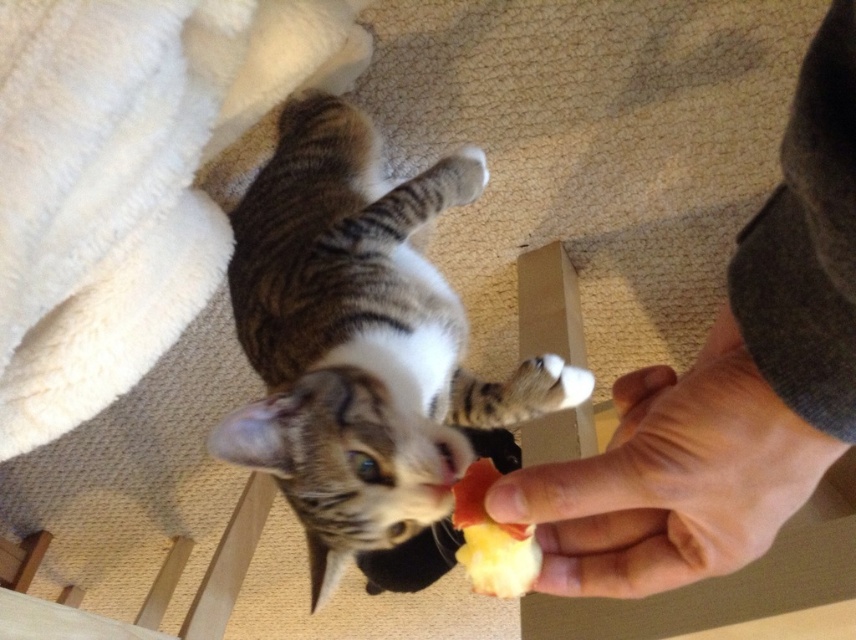
You are a cat owner who wants to feed your tabby fur cat at center with the yellowish matte apple slice at center. Based on their positions, which object is closer to the left side of the image?

The tabby fur cat at center is closer to the left side of the image than the yellowish matte apple slice at center.

You are a cat who wants to reach the food held by two hands in the lower right. Which hand should you approach first, the gray fabric hand at lower right or the smooth skin hand at lower right?

The gray fabric hand at lower right is closer to the viewer than the smooth skin hand at lower right, so the cat should approach the gray fabric hand at lower right first.

You are a cat who wants to reach the food held by the two hands in the scene. Which hand should you approach first if you want to get to the one closer to your current position? The hands are labeled as gray fabric hand at lower right and smooth skin hand at lower right.

You should approach the smooth skin hand at lower right first because the gray fabric hand at lower right is to the right of it, meaning the smooth skin hand is closer to your current position.